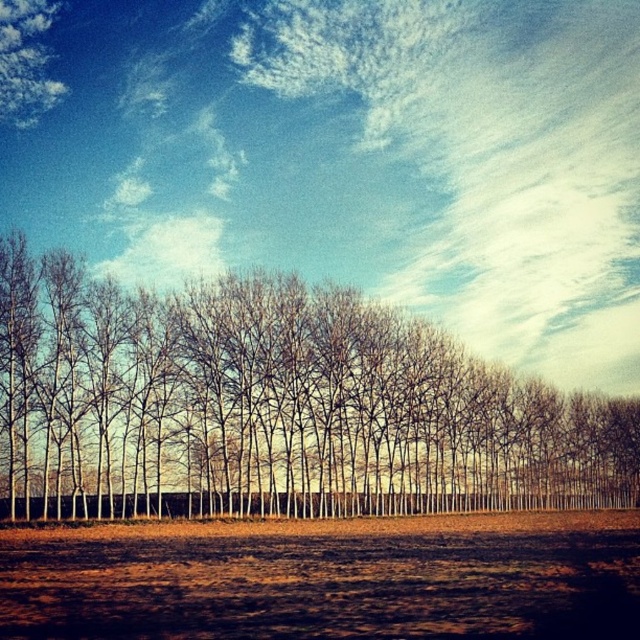
Measure the distance from bare branches at center to brown soil at lower center.

19.55 meters

Locate an element on the screen. This screenshot has width=640, height=640. bare branches at center is located at coordinates (275, 406).

The height and width of the screenshot is (640, 640). Find the location of `bare branches at center`. bare branches at center is located at coordinates (275, 406).